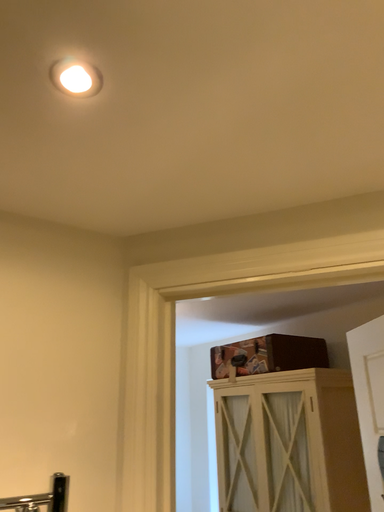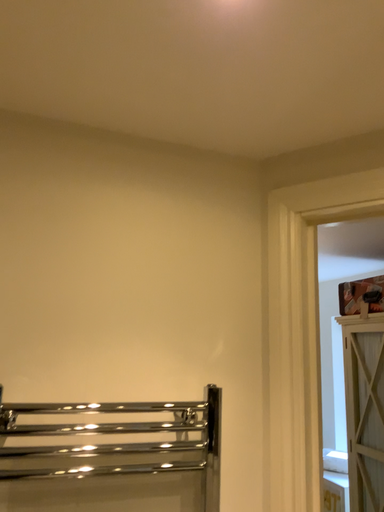
Question: Which way did the camera rotate in the video?

Choices:
 (A) rotated downward
 (B) rotated upward

Answer: (A)